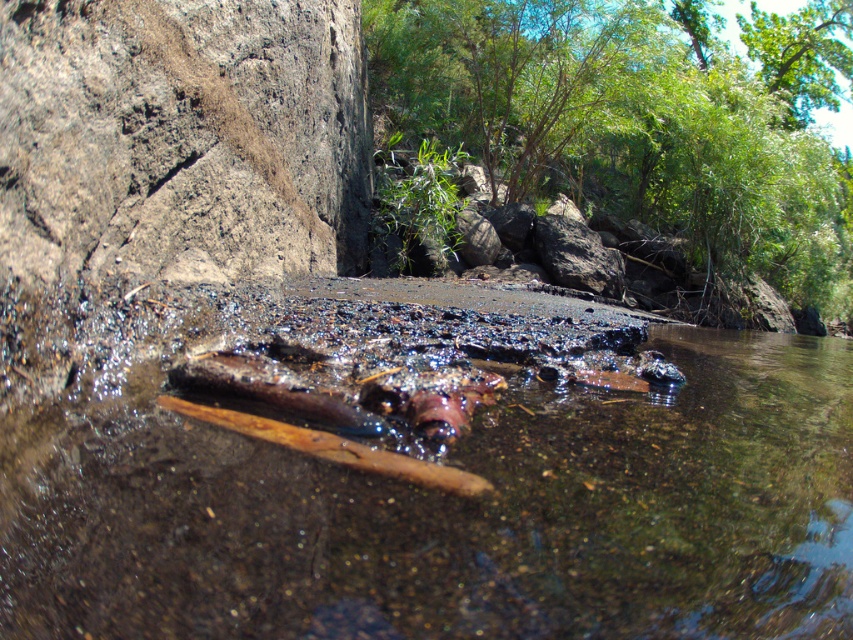
Does brown wood at center come behind rough textured rock at left?

No, it is not.

Where is `brown wood at center`? brown wood at center is located at coordinates (451, 513).

This screenshot has height=640, width=853. I want to click on brown wood at center, so click(451, 513).